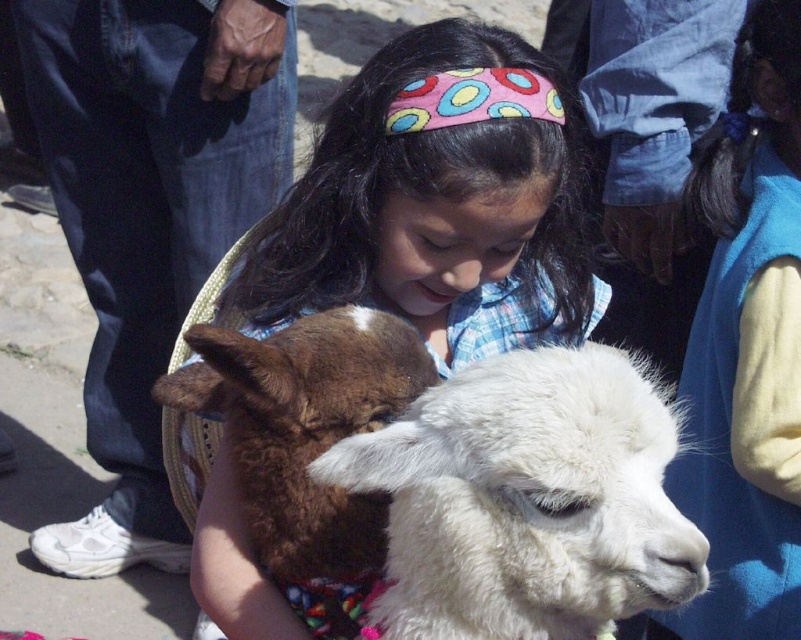
Is white fluffy alpaca at center bigger than fluffy white alpaca at center?

Actually, white fluffy alpaca at center might be smaller than fluffy white alpaca at center.

Can you confirm if white fluffy alpaca at center is positioned to the left of fluffy white alpaca at center?

In fact, white fluffy alpaca at center is to the right of fluffy white alpaca at center.

You are a GUI agent. You are given a task and a screenshot of the screen. Output one action in this format:
    pyautogui.click(x=<x>, y=<y>)
    Task: Click on the white fluffy alpaca at center
    Image resolution: width=801 pixels, height=640 pixels.
    Given the screenshot: What is the action you would take?
    pyautogui.click(x=449, y=461)